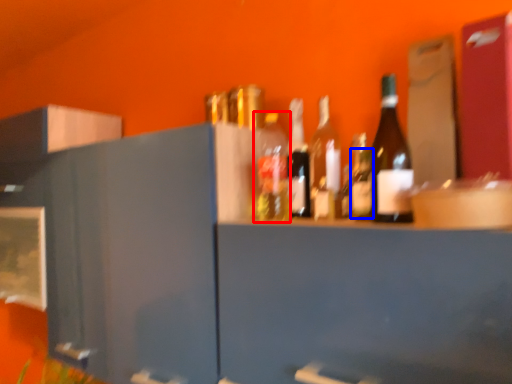
Question: Which object is closer to the camera taking this photo, bottle (highlighted by a red box) or bottle (highlighted by a blue box)?

Choices:
 (A) bottle
 (B) bottle

Answer: (B)